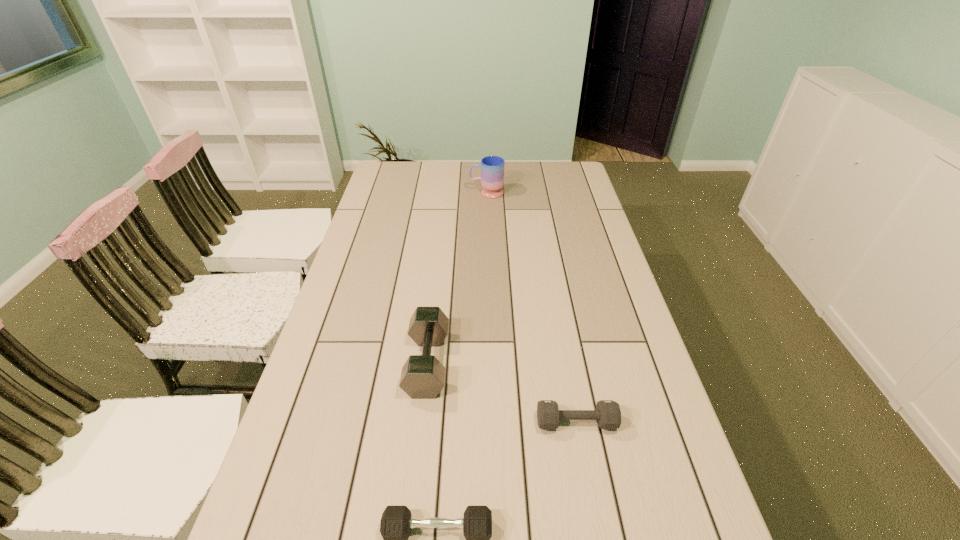
Where is `vacant region that satisfies the following two spatial constraints: 1. on the back side of the second nearest dumbbell; 2. on the side of the farthest object with the handle`? Image resolution: width=960 pixels, height=540 pixels. vacant region that satisfies the following two spatial constraints: 1. on the back side of the second nearest dumbbell; 2. on the side of the farthest object with the handle is located at coordinates (535, 193).

The height and width of the screenshot is (540, 960). I want to click on free location that satisfies the following two spatial constraints: 1. on the side of the tallest object with the handle; 2. on the front side of the farthest dumbbell, so click(491, 363).

The image size is (960, 540). Identify the location of free point that satisfies the following two spatial constraints: 1. on the side of the rightmost object with the handle; 2. on the left side of the tallest object. (492, 422).